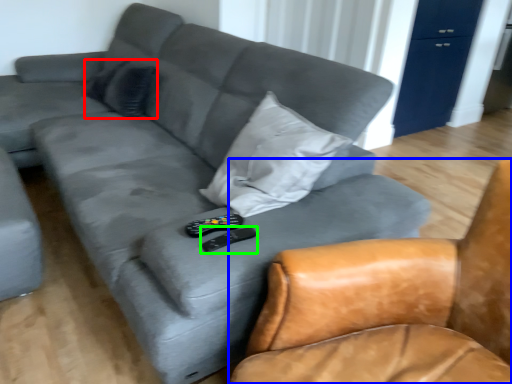
Question: Considering the real-world distances, which object is closest to pillow (highlighted by a red box)? chair (highlighted by a blue box) or remote (highlighted by a green box).

Choices:
 (A) chair
 (B) remote

Answer: (B)